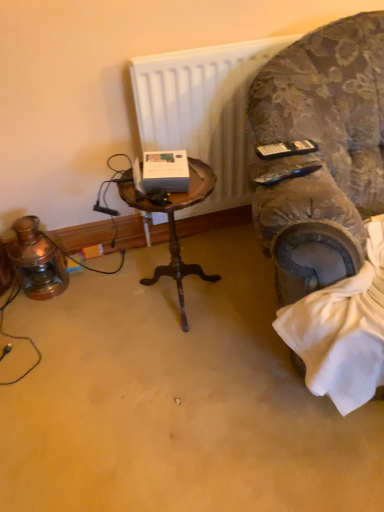
Locate an element on the screen. This screenshot has height=512, width=384. free point below white matte radiator at upper center (from a real-world perspective) is located at coordinates (211, 232).